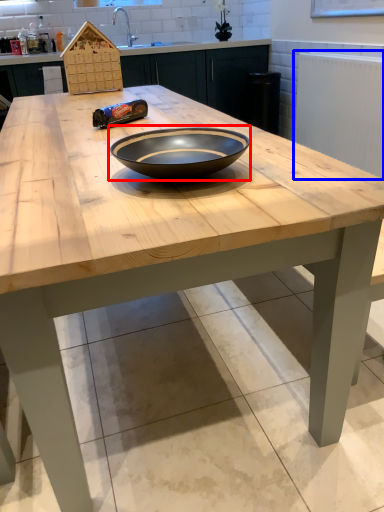
Question: Among these objects, which one is nearest to the camera, bowl (highlighted by a red box) or radiator (highlighted by a blue box)?

Choices:
 (A) bowl
 (B) radiator

Answer: (A)